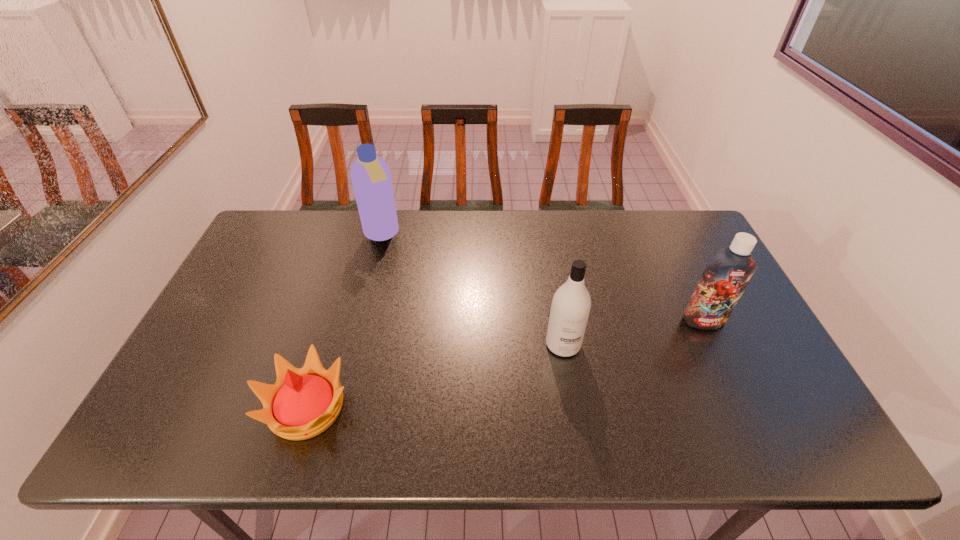
The width and height of the screenshot is (960, 540). Identify the location of the leftmost shampoo. (371, 178).

Locate an element on the screen. The height and width of the screenshot is (540, 960). the farthest object is located at coordinates (371, 178).

The image size is (960, 540). I want to click on the rightmost object, so coord(726,275).

The width and height of the screenshot is (960, 540). What are the coordinates of `the second shampoo from right to left` in the screenshot? It's located at (570, 309).

Find the location of a particular element. This screenshot has height=540, width=960. the nearest object is located at coordinates (304, 402).

Identify the location of the shortest object. (304, 402).

Where is `vacant space located on the left of the farthest shampoo`? This screenshot has width=960, height=540. vacant space located on the left of the farthest shampoo is located at coordinates (323, 234).

You are a GUI agent. You are given a task and a screenshot of the screen. Output one action in this format:
    pyautogui.click(x=<x>, y=<y>)
    Task: Click on the vacant space located 0.200m on the front label of the rightmost object
    The image size is (960, 540).
    Given the screenshot: What is the action you would take?
    pyautogui.click(x=739, y=396)

Where is `free space located on the front-facing side of the second shampoo from right to left`? free space located on the front-facing side of the second shampoo from right to left is located at coordinates (575, 416).

Where is `free space located on the back of the nearest object`? free space located on the back of the nearest object is located at coordinates (341, 300).